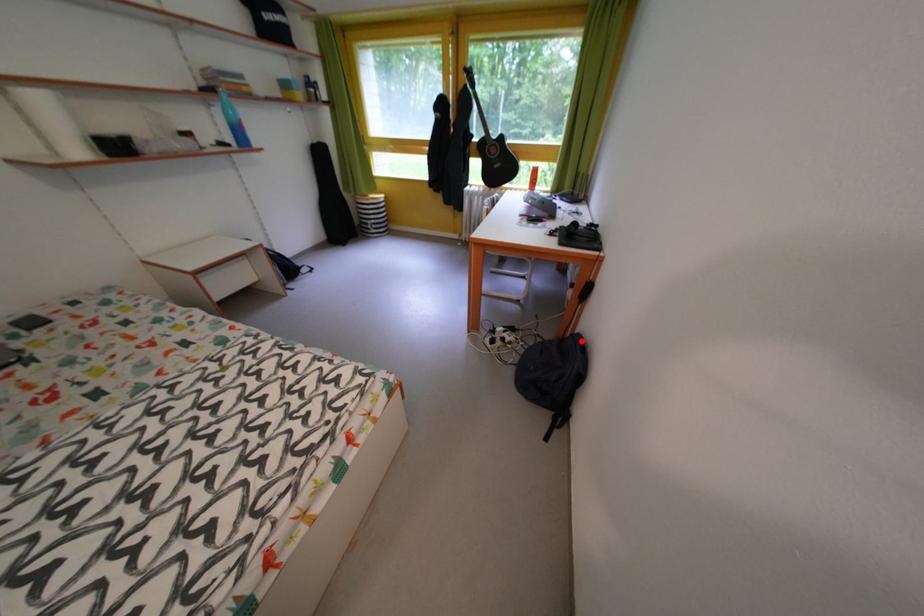
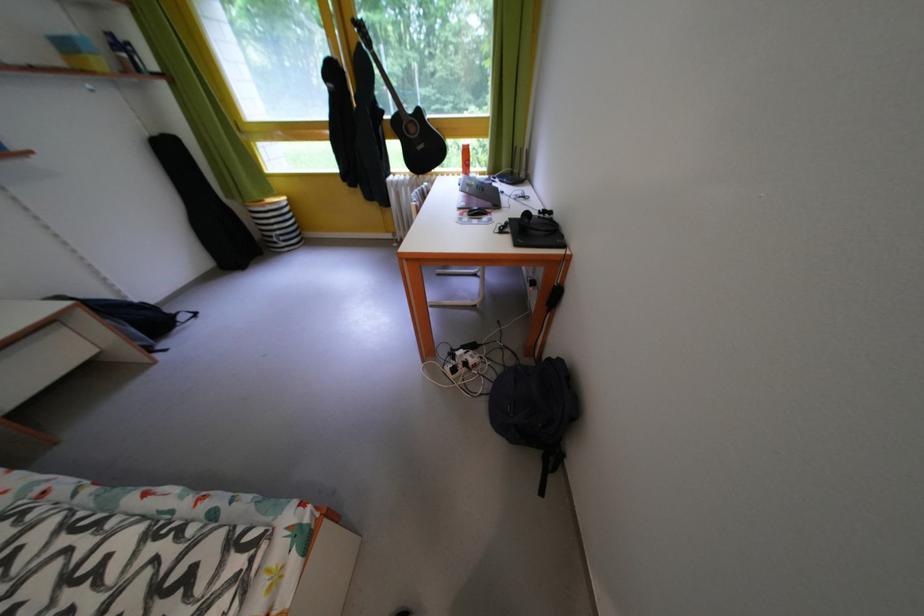
Find the pixel in the second image that matches the highlighted location in the first image.

(558, 365)